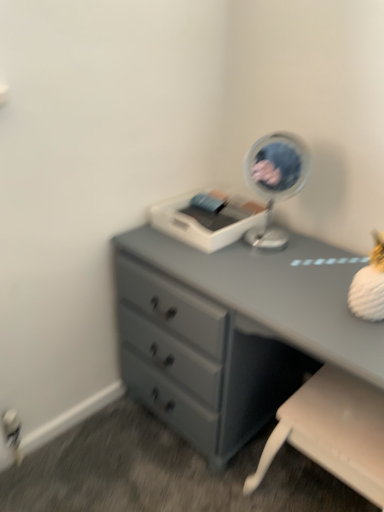
Identify the location of free space on the front side of metallic silver mirror at upper right. (271, 278).